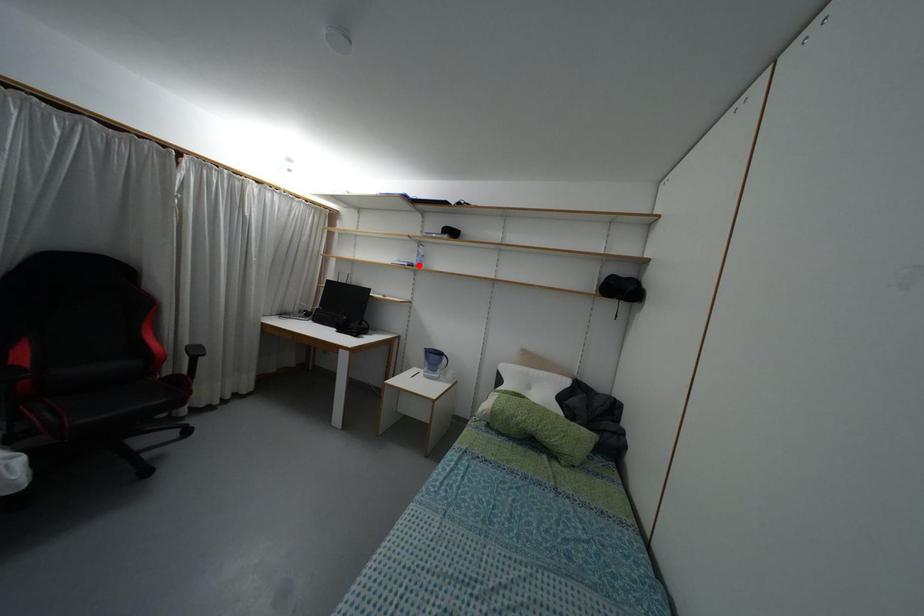
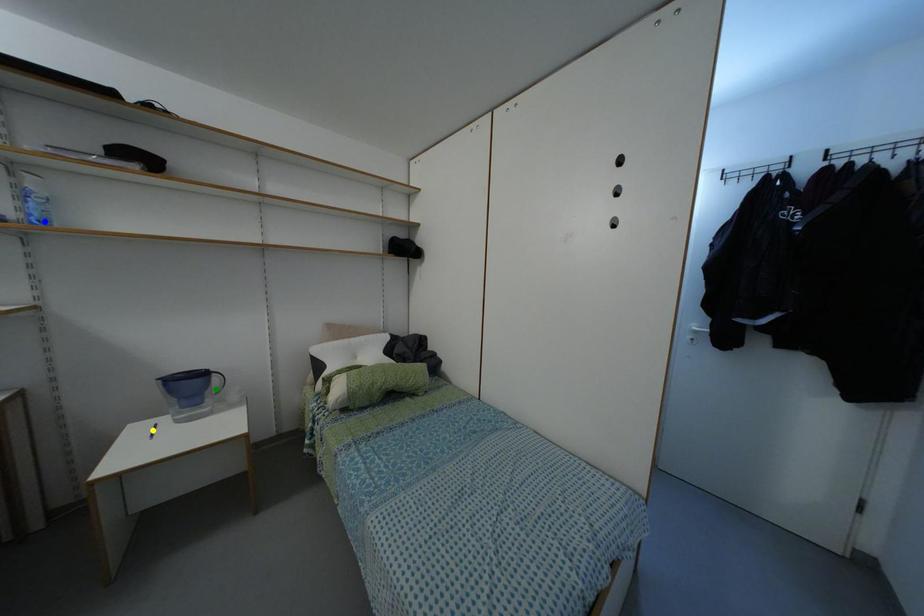
Question: I am providing you with two images of the same scene from different viewpoints. A red point is marked on the first image. You are given multiple points on the second image. Which mark in image 2 goes with the point in image 1?

Choices:
 (A) green point
 (B) blue point
 (C) yellow point

Answer: (B)